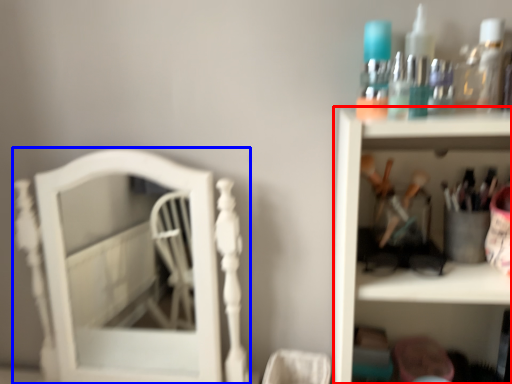
Question: Among these objects, which one is nearest to the camera, shelf (highlighted by a red box) or furniture (highlighted by a blue box)?

Choices:
 (A) shelf
 (B) furniture

Answer: (A)